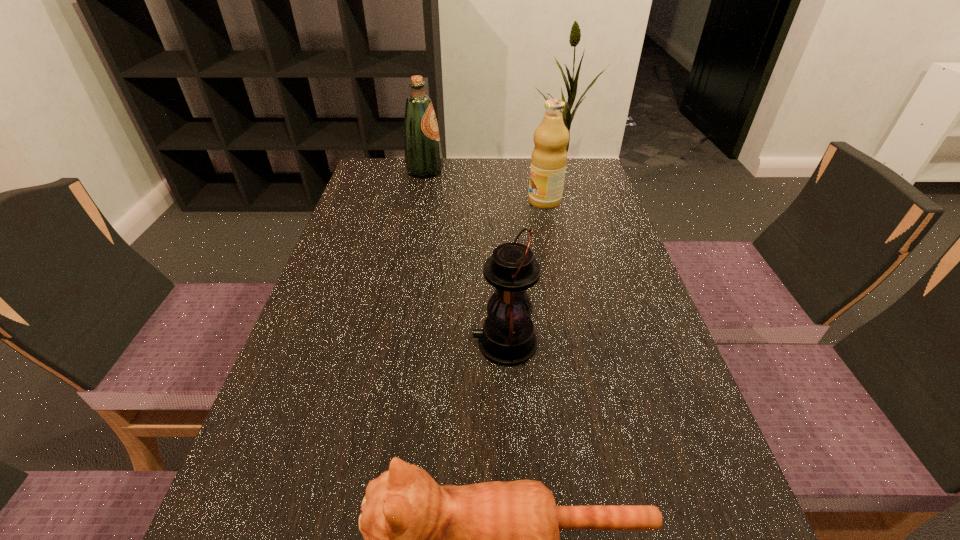
You are a GUI agent. You are given a task and a screenshot of the screen. Output one action in this format:
    pyautogui.click(x=<x>, y=<y>)
    Task: Click on the left olive oil
    The width and height of the screenshot is (960, 540).
    Given the screenshot: What is the action you would take?
    pyautogui.click(x=423, y=156)

Locate an element on the screen. the farthest object is located at coordinates (423, 156).

What are the coordinates of `the right olive oil` in the screenshot? It's located at (549, 157).

At what (x,y) coordinates should I click in order to perform the action: click on the second farthest object. Please return your answer as a coordinate pair (x, y). Looking at the image, I should click on (549, 157).

Find the location of `the third farthest object`. the third farthest object is located at coordinates (507, 338).

Locate an element on the screen. vacant space located 0.300m on the front-facing side of the farther olive oil is located at coordinates (539, 171).

The image size is (960, 540). Find the location of `free space located on the label of the second farthest object`. free space located on the label of the second farthest object is located at coordinates (461, 201).

Locate an element on the screen. blank area located on the label of the second farthest object is located at coordinates (475, 201).

The height and width of the screenshot is (540, 960). In order to click on free region located on the label of the second farthest object in this screenshot , I will do `click(440, 201)`.

Where is a free space located 0.110m above the lantern, indicating its light source? Please provide its 2D coordinates. Your answer should be formatted as a tuple, i.e. [(x, y)], where the tuple contains the x and y coordinates of a point satisfying the conditions above.

[(417, 343)]